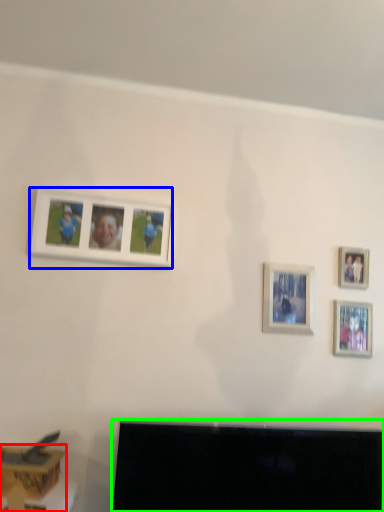
Question: Based on their relative distances, which object is nearer to furniture (highlighted by a red box)? Choose from picture frame (highlighted by a blue box) and television (highlighted by a green box).

Choices:
 (A) picture frame
 (B) television

Answer: (B)